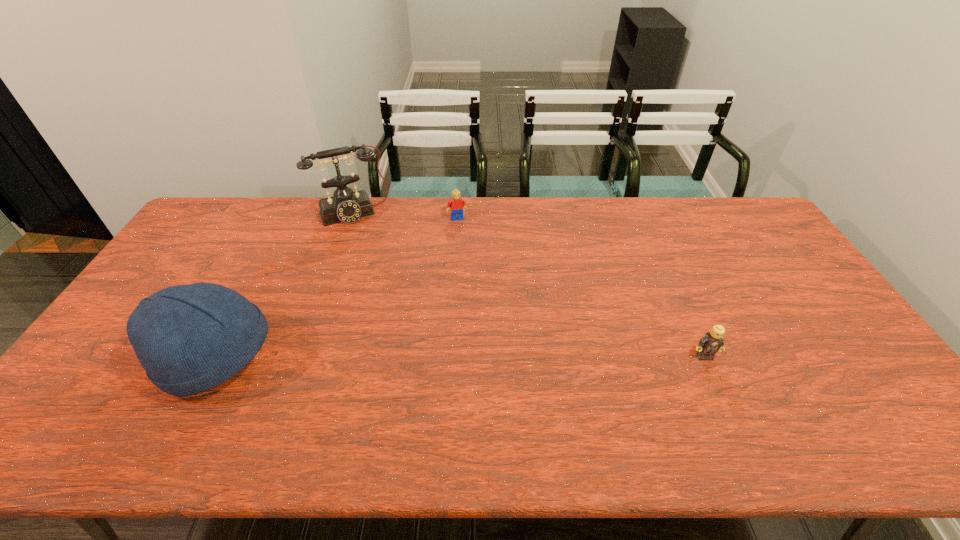
You are a GUI agent. You are given a task and a screenshot of the screen. Output one action in this format:
    pyautogui.click(x=<x>, y=<y>)
    Task: Click on the free space that is in between the telephone and the left Lego
    Image resolution: width=960 pixels, height=540 pixels.
    Given the screenshot: What is the action you would take?
    pyautogui.click(x=405, y=216)

You are a GUI agent. You are given a task and a screenshot of the screen. Output one action in this format:
    pyautogui.click(x=<x>, y=<y>)
    Task: Click on the empty space that is in between the third object from left to right and the rightmost object
    Image resolution: width=960 pixels, height=540 pixels.
    Given the screenshot: What is the action you would take?
    pyautogui.click(x=581, y=287)

Identify the location of free spot between the second tallest object and the nearer Lego. pyautogui.click(x=460, y=357).

Identify the location of object that is the second closest to the right Lego. The image size is (960, 540). (346, 206).

Find the location of a particular element. object that is the closest to the right Lego is located at coordinates (457, 204).

Find the location of a particular element. vacant space that satisfies the following two spatial constraints: 1. on the back side of the third object from left to right; 2. on the right side of the third shortest object is located at coordinates (289, 218).

Where is `free space that satisfies the following two spatial constraints: 1. on the back side of the telephone; 2. on the left side of the skullcap`? The image size is (960, 540). free space that satisfies the following two spatial constraints: 1. on the back side of the telephone; 2. on the left side of the skullcap is located at coordinates (292, 213).